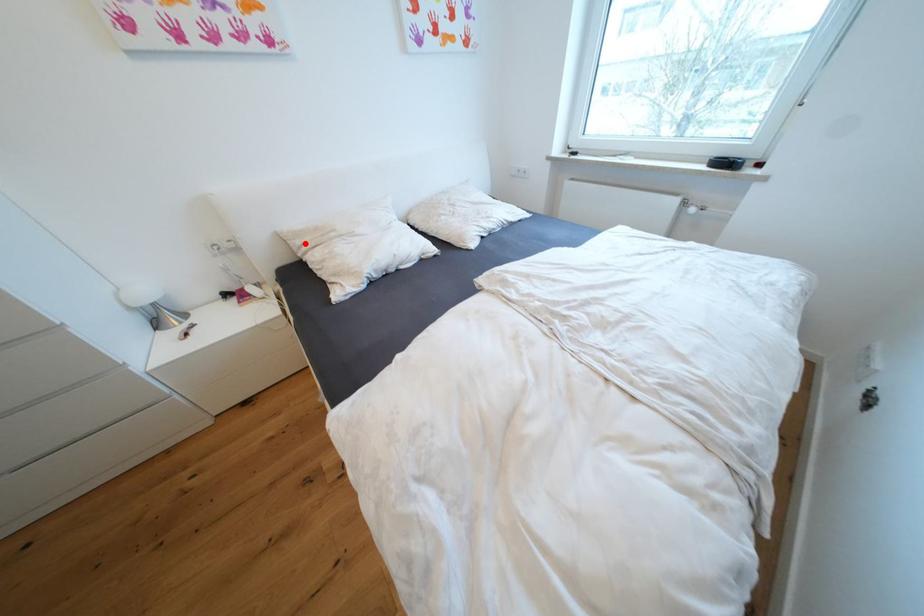
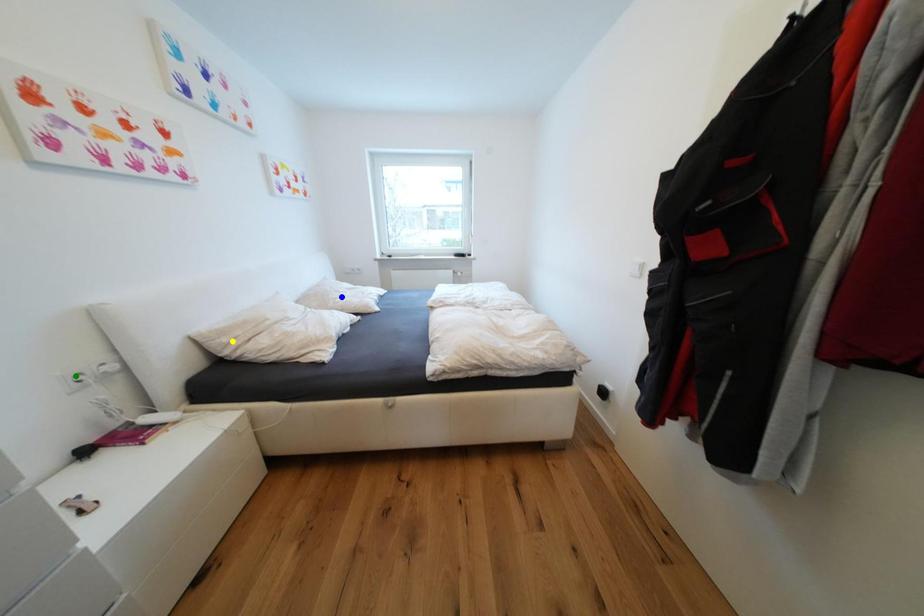
Question: I am providing you with two images of the same scene from different viewpoints. A red point is marked on the first image. You are given multiple points on the second image. Can you choose the point in image 2 that corresponds to the point in image 1?

Choices:
 (A) green point
 (B) blue point
 (C) yellow point

Answer: (C)